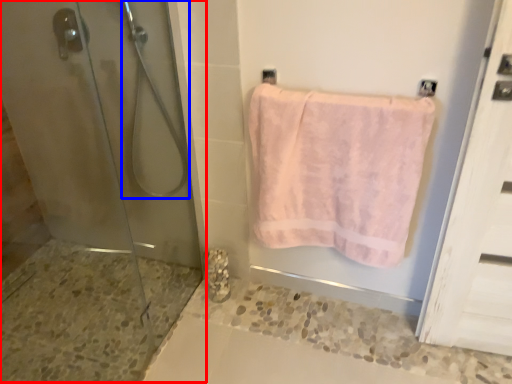
Question: Which of the following is the farthest to the observer, shower door (highlighted by a red box) or shower (highlighted by a blue box)?

Choices:
 (A) shower door
 (B) shower

Answer: (B)